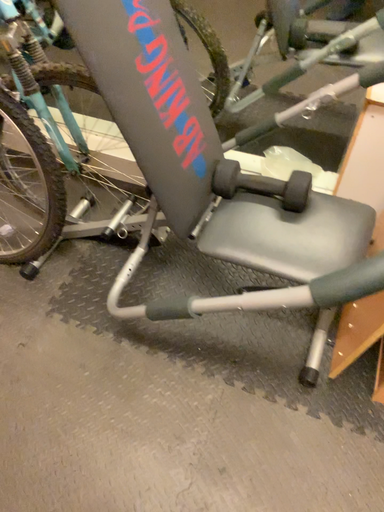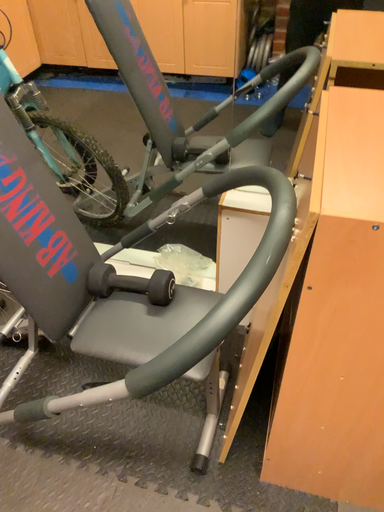
Question: How did the camera likely rotate when shooting the video?

Choices:
 (A) rotated upward
 (B) rotated downward

Answer: (A)